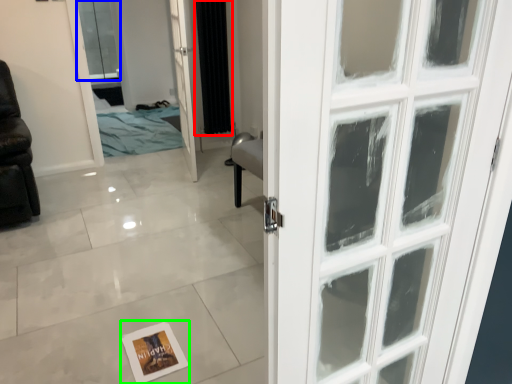
Question: Considering the real-world distances, which object is closest to curtain (highlighted by a red box)? window (highlighted by a blue box) or postcard (highlighted by a green box).

Choices:
 (A) window
 (B) postcard

Answer: (B)